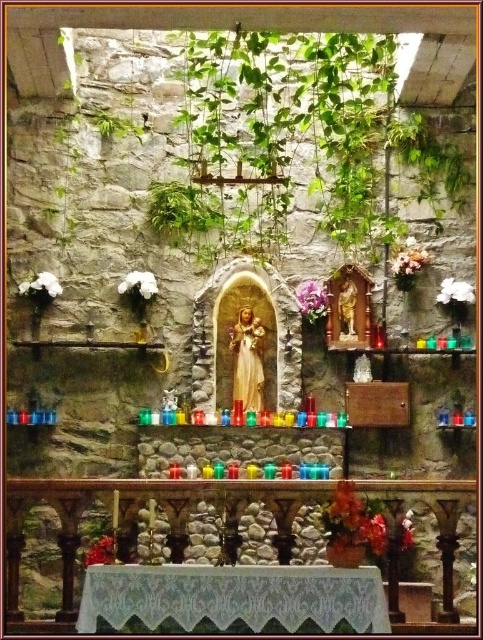
Who is lower down, purple silk flower at center or white fluffy cloud at upper left?

purple silk flower at center

Measure the distance between point (x=320, y=298) and camera.

Point (x=320, y=298) and camera are 11.47 meters apart from each other.

Locate an element on the screen. purple silk flower at center is located at coordinates (312, 300).

Does white matte flower at upper right come behind white matte flower at left?

Yes, white matte flower at upper right is further from the viewer.

Which is in front, point (453, 291) or point (142, 294)?

Point (142, 294) is in front.

I want to click on white matte flower at upper right, so click(454, 291).

Does matte red flower at lower right appear on the right side of bright red fabric at lower left?

Correct, you'll find matte red flower at lower right to the right of bright red fabric at lower left.

Consider the image. Who is lower down, matte red flower at lower right or bright red fabric at lower left?

bright red fabric at lower left is lower down.

Is point (369, 548) closer to camera compared to point (85, 557)?

Yes.

Image resolution: width=483 pixels, height=640 pixels. Find the location of `matte red flower at lower right`. matte red flower at lower right is located at coordinates point(372,532).